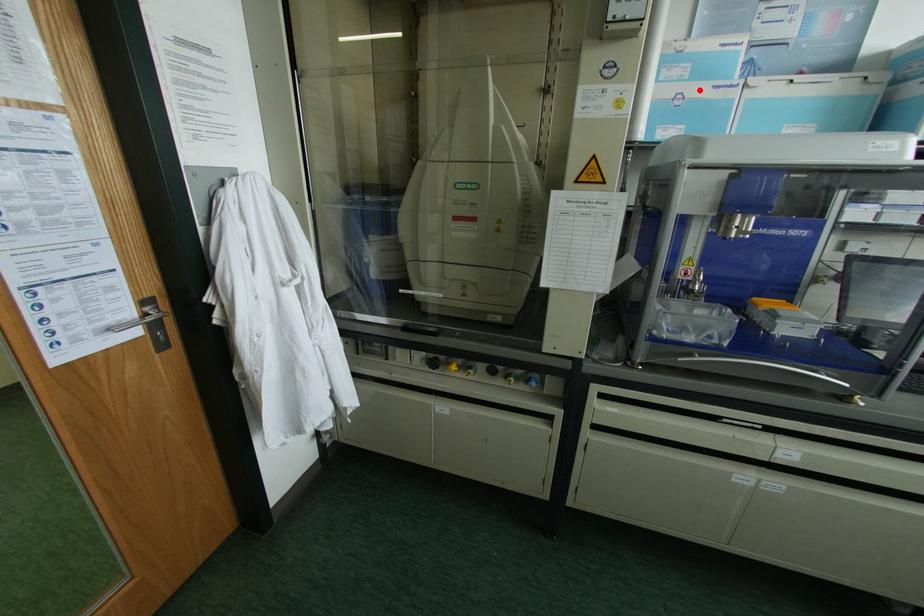
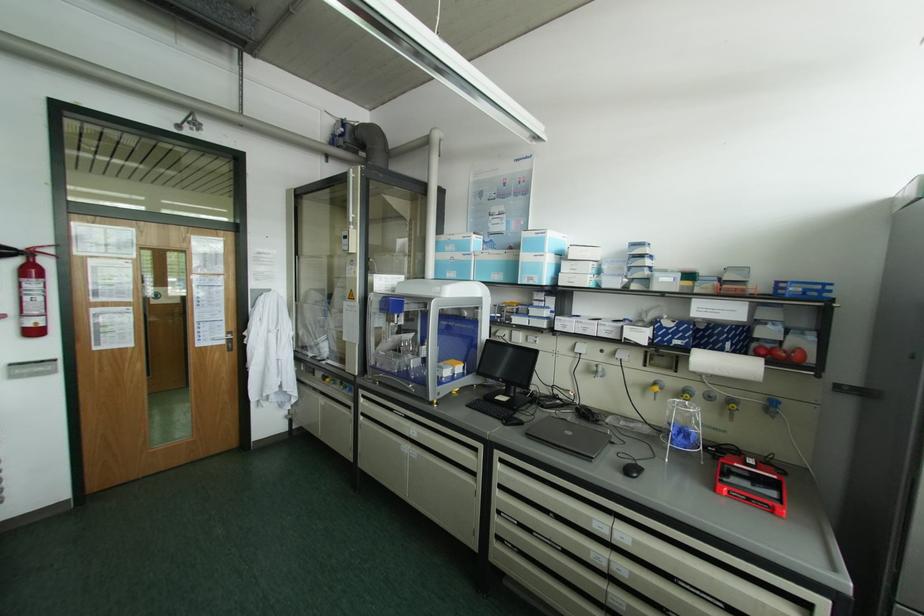
Where in the second image is the point corresponding to the highlighted location from the first image?

(457, 256)